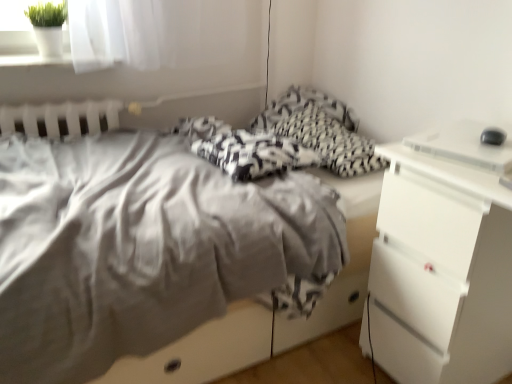
This screenshot has width=512, height=384. Identify the location of free space above white plastic desktop at right (from a real-world perspective). (468, 140).